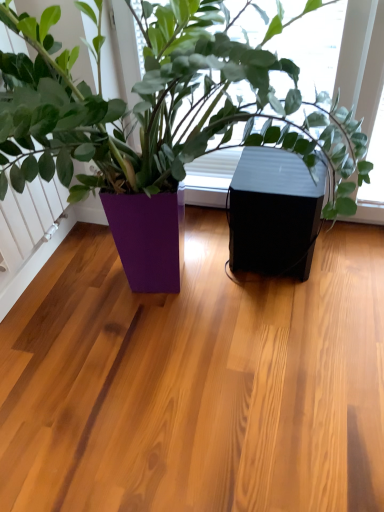
Locate an element on the screen. This screenshot has width=384, height=512. blank space to the left of black matte speaker at center is located at coordinates (201, 258).